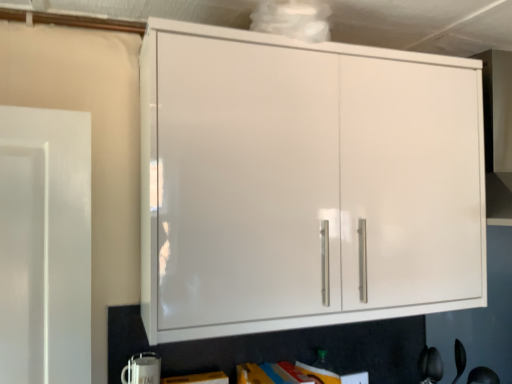
Question: Is white glossy mug at lower left further to camera compared to white glossy cabinet at upper center?

Choices:
 (A) yes
 (B) no

Answer: (A)

Question: Considering the relative positions of white glossy mug at lower left and white glossy cabinet at upper center in the image provided, is white glossy mug at lower left in front of white glossy cabinet at upper center?

Choices:
 (A) no
 (B) yes

Answer: (A)

Question: Is white glossy mug at lower left turned away from white glossy cabinet at upper center?

Choices:
 (A) no
 (B) yes

Answer: (A)

Question: From a real-world perspective, is white glossy mug at lower left over white glossy cabinet at upper center?

Choices:
 (A) yes
 (B) no

Answer: (B)

Question: From the image's perspective, is white glossy mug at lower left above white glossy cabinet at upper center?

Choices:
 (A) no
 (B) yes

Answer: (A)

Question: From a real-world perspective, is white glossy mug at lower left beneath white glossy cabinet at upper center?

Choices:
 (A) no
 (B) yes

Answer: (B)

Question: Is white glossy cabinet at upper center further to the viewer compared to white glossy mug at lower left?

Choices:
 (A) no
 (B) yes

Answer: (A)

Question: Is white glossy cabinet at upper center shorter than white glossy mug at lower left?

Choices:
 (A) no
 (B) yes

Answer: (A)

Question: From the image's perspective, is white glossy cabinet at upper center under white glossy mug at lower left?

Choices:
 (A) no
 (B) yes

Answer: (A)

Question: Considering the relative sizes of white glossy cabinet at upper center and white glossy mug at lower left in the image provided, is white glossy cabinet at upper center wider than white glossy mug at lower left?

Choices:
 (A) no
 (B) yes

Answer: (B)

Question: Does white glossy cabinet at upper center have a lesser width compared to white glossy mug at lower left?

Choices:
 (A) yes
 (B) no

Answer: (B)

Question: Is white glossy cabinet at upper center smaller than white glossy mug at lower left?

Choices:
 (A) yes
 (B) no

Answer: (B)

Question: Relative to white glossy cabinet at upper center, is white glossy mug at lower left in front or behind?

Choices:
 (A) behind
 (B) front

Answer: (A)